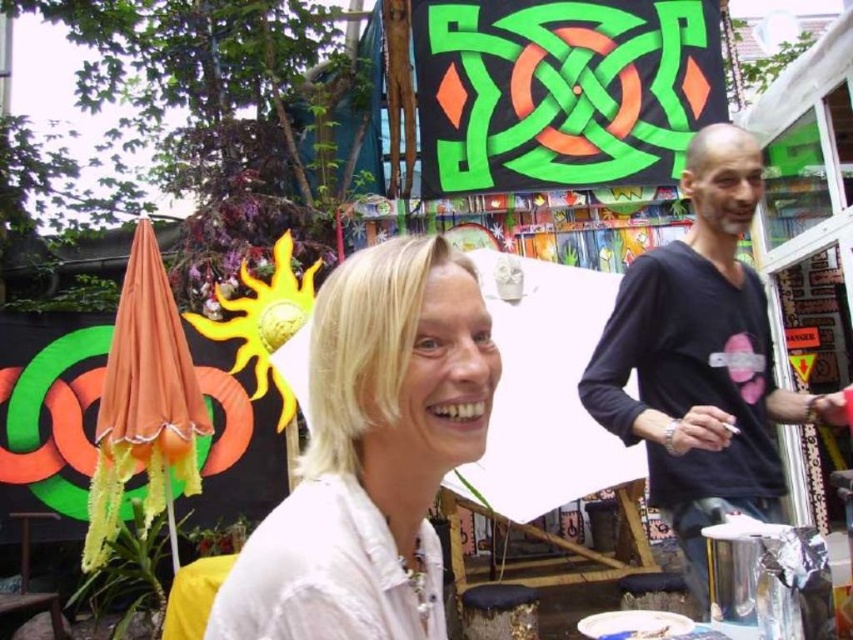
You are at a festival and want to take a photo of the white matte shirt at center and the black matte shirt at right. To ensure both are visible, which one should you focus on first?

You should focus on the white matte shirt at center first because it is positioned under the black matte shirt at right, so adjusting focus starting from the lower layer ensures both are in frame.

You are organizing a clothing display and need to place the white matte shirt at center and the black matte shirt at right side by side. Which shirt should you place on the left side to make the display look balanced?

To balance the display, place the white matte shirt at center on the left side since it has a lesser width compared to the black matte shirt at right, which is wider. This arrangement will create a balanced look by offsetting the wider shirt on the right with the narrower one on the left.

You are at the festival and want to find the person wearing the white matte shirt at center. According to the coordinates provided, where should you look in the image?

The white matte shirt at center is located at point [370,452], so you should look towards the lower right area of the image to find the person wearing it.